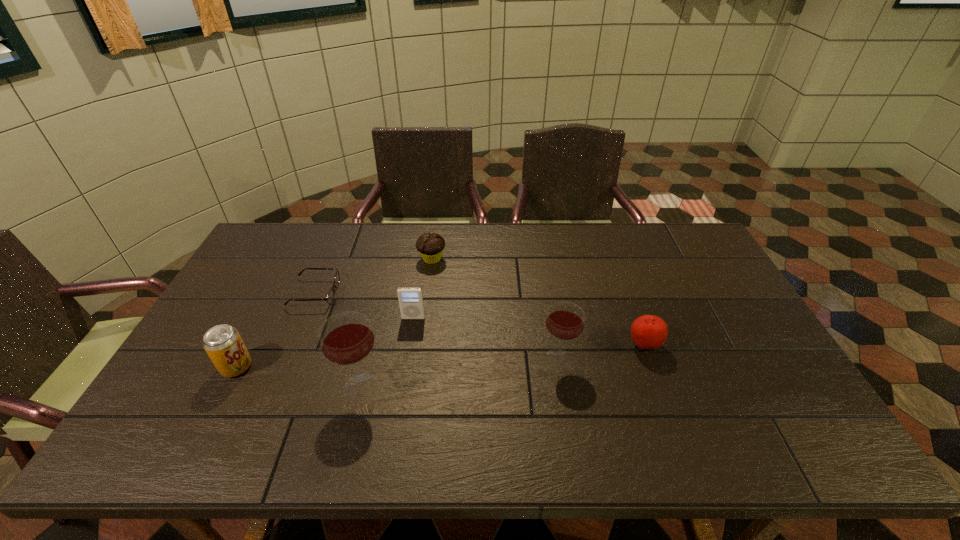
Where is `vacant space located on the back of the taller wineglass`? vacant space located on the back of the taller wineglass is located at coordinates (387, 280).

This screenshot has width=960, height=540. In order to click on free location located on the right of the second object from right to left in this screenshot , I will do `click(632, 359)`.

Where is `free space located 0.200m on the front-facing side of the third farthest object`? This screenshot has width=960, height=540. free space located 0.200m on the front-facing side of the third farthest object is located at coordinates (404, 376).

The height and width of the screenshot is (540, 960). In order to click on vacant space located 0.150m on the right of the muffin in this screenshot , I will do `click(490, 259)`.

Locate an element on the screen. This screenshot has height=540, width=960. vacant region located on the back of the leftmost object is located at coordinates (270, 301).

What are the coordinates of `vacant space situated on the lenses of the shortest object` in the screenshot? It's located at [x=444, y=293].

Where is `free space located 0.160m on the front of the rightmost object`? free space located 0.160m on the front of the rightmost object is located at coordinates (668, 411).

Find the location of a particular element. The image size is (960, 540). object located at the far edge is located at coordinates (430, 246).

The width and height of the screenshot is (960, 540). I want to click on object situated at the near edge, so click(346, 338).

Locate an element on the screen. object that is at the left edge is located at coordinates (223, 344).